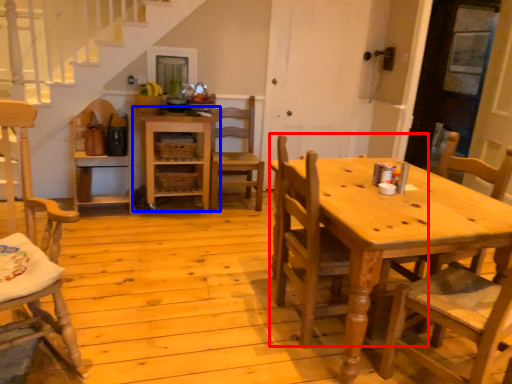
Question: Which object is closer to the camera taking this photo, chair (highlighted by a red box) or shelf (highlighted by a blue box)?

Choices:
 (A) chair
 (B) shelf

Answer: (A)